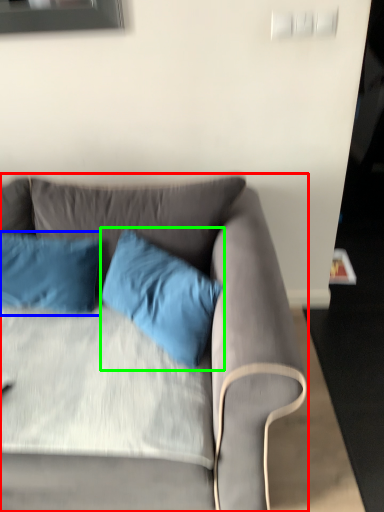
Question: Which object is positioned closest to studio couch (highlighted by a red box)? Select from pillow (highlighted by a blue box) and pillow (highlighted by a green box).

Choices:
 (A) pillow
 (B) pillow

Answer: (B)